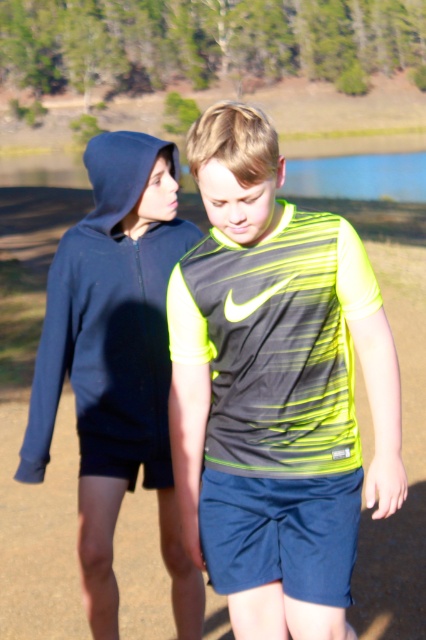
You are a photographer trying to capture a photo of the neon yellow fabric shirt at center and the dirt track at center. From the photographer perspective, which object is located to the right of the other?

The neon yellow fabric shirt at center is positioned on the right side of dirt track at center, so the neon yellow fabric shirt at center is to the right of the dirt track at center.

Based on the scene description, where is the dirt track at center located in terms of its 2D coordinates?

The dirt track at center is located at the 2D coordinates of point (405, 465).